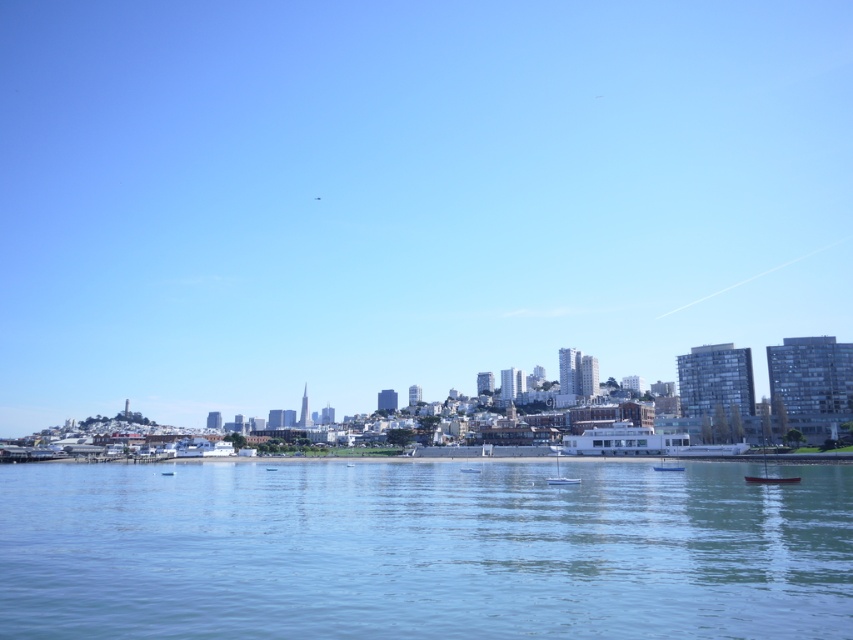
You are a photographer planning to capture the waterfront scene. You want to ensure that the transparent glass skyline at center and the clear blue water at center are both visible in your shot. Which object should you focus on to frame the wider part of the scene?

The transparent glass skyline at center is wider than the clear blue water at center, so focusing on the transparent glass skyline at center will help frame the wider part of the scene.

You are a photographer planning to capture the waterfront scene. You want to ensure that both the transparent glass skyline at center and the clear blue water at center are clearly visible in your photo. Based on their sizes in the image, which object should you prioritize framing to ensure it stands out more?

The transparent glass skyline at center is larger in size than the clear blue water at center, so you should prioritize framing the transparent glass skyline at center to ensure it stands out more in the photo.